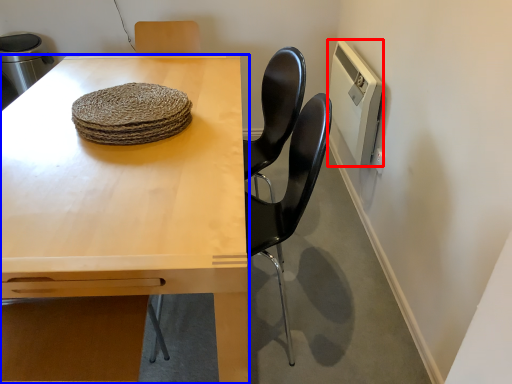
Question: Which point is closer to the camera, appliance (highlighted by a red box) or table (highlighted by a blue box)?

Choices:
 (A) appliance
 (B) table

Answer: (B)